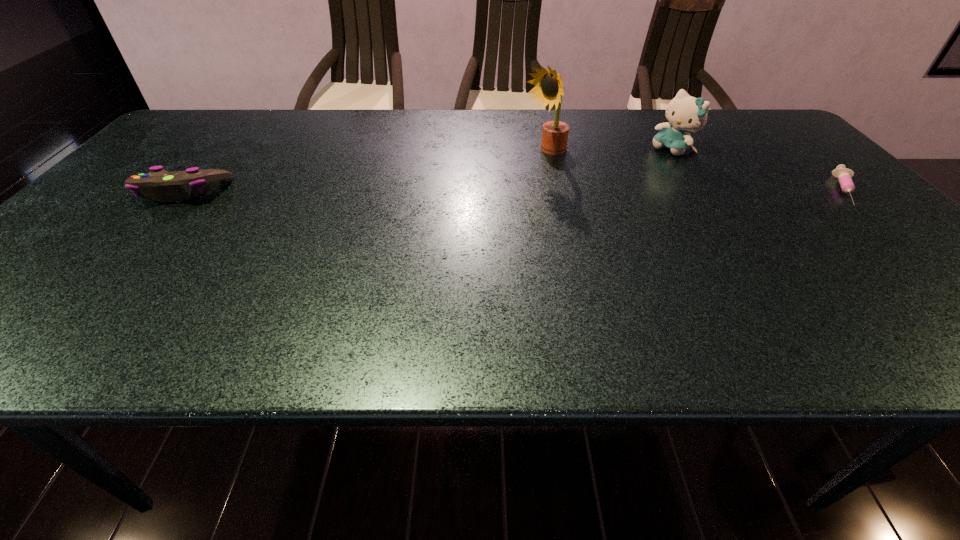
Locate an element on the screen. The width and height of the screenshot is (960, 540). vacant space at the far edge is located at coordinates [467, 144].

In the image, there is a desktop. Find the location of `vacant space at the near edge`. vacant space at the near edge is located at coordinates (137, 304).

Locate an element on the screen. The width and height of the screenshot is (960, 540). free space at the left edge is located at coordinates (60, 245).

Where is `vacant area at the right edge of the desktop`? Image resolution: width=960 pixels, height=540 pixels. vacant area at the right edge of the desktop is located at coordinates (819, 225).

At what (x,y) coordinates should I click in order to perform the action: click on vacant region at the far left corner of the desktop. Please return your answer as a coordinate pair (x, y). Looking at the image, I should click on (204, 109).

The width and height of the screenshot is (960, 540). I want to click on vacant space at the far right corner of the desktop, so click(x=724, y=109).

Locate an element on the screen. vacant space that's between the control and the third object from right to left is located at coordinates (364, 173).

This screenshot has width=960, height=540. I want to click on free space that is in between the shortest object and the tallest object, so click(x=695, y=172).

Where is `free space between the second tallest object and the shortest object`? free space between the second tallest object and the shortest object is located at coordinates (759, 170).

Image resolution: width=960 pixels, height=540 pixels. In order to click on free spot between the shortest object and the sunflower in this screenshot , I will do `click(695, 172)`.